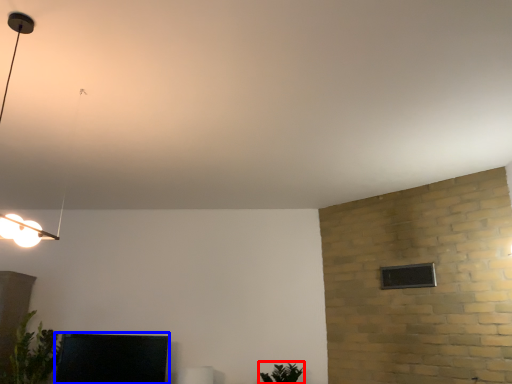
Question: Which object appears closest to the camera in this image, plant (highlighted by a red box) or furniture (highlighted by a blue box)?

Choices:
 (A) plant
 (B) furniture

Answer: (A)